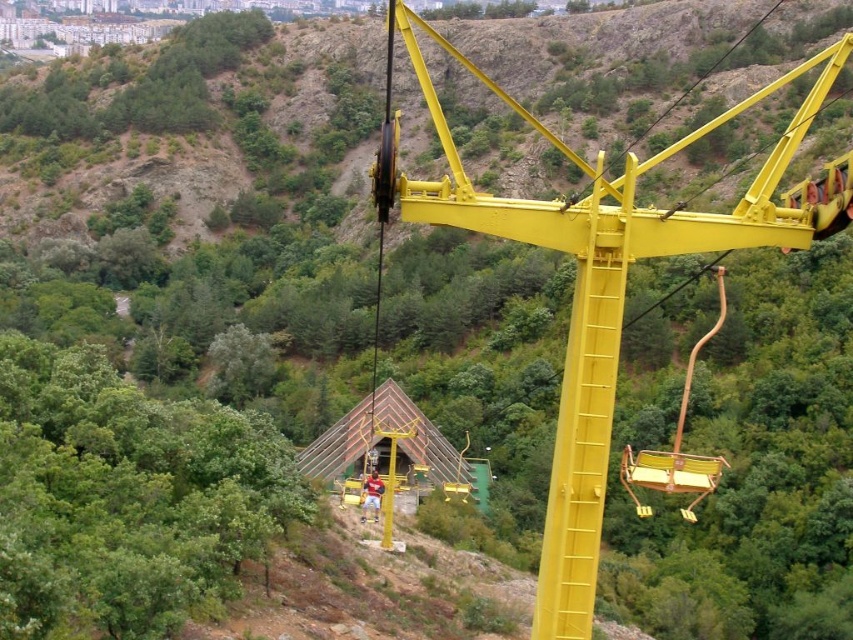
You are a maintenance worker inspecting the yellow metallic crane at center and the metallic yellow swing at right. Which object do you need to look up more to inspect?

The yellow metallic crane at center is taller than the metallic yellow swing at right, so you need to look up more to inspect the yellow metallic crane at center.

You are standing at the base of the hillside looking at the cable car system. There are two points marked in the image. Which point is closer to you, point [412,205] or point [695,460]?

Point [412,205] is closer to the viewer than point [695,460].